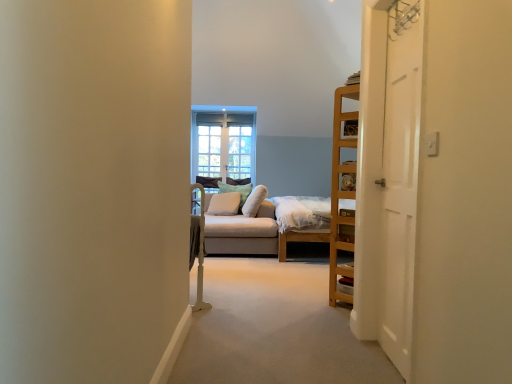
Question: Should I look upward or downward to see green fabric pillow at center, placed as the second pillow when sorted from right to left?

Choices:
 (A) down
 (B) up

Answer: (A)

Question: Is clear glass window at center further to camera compared to green fabric pillow at center, arranged as the 2th pillow when viewed from the left?

Choices:
 (A) no
 (B) yes

Answer: (B)

Question: Could you tell me if clear glass window at center is turned towards green fabric pillow at center, arranged as the 2th pillow when viewed from the left?

Choices:
 (A) no
 (B) yes

Answer: (B)

Question: Is clear glass window at center smaller than green fabric pillow at center, arranged as the 2th pillow when viewed from the left?

Choices:
 (A) yes
 (B) no

Answer: (A)

Question: From the image's perspective, is clear glass window at center above green fabric pillow at center, arranged as the 2th pillow when viewed from the left?

Choices:
 (A) yes
 (B) no

Answer: (A)

Question: Is clear glass window at center closer to the viewer compared to green fabric pillow at center, arranged as the 2th pillow when viewed from the left?

Choices:
 (A) no
 (B) yes

Answer: (A)

Question: Does clear glass window at center have a lesser height compared to green fabric pillow at center, arranged as the 2th pillow when viewed from the left?

Choices:
 (A) yes
 (B) no

Answer: (B)

Question: Does soft white cushion at center, which ranks as the 3th pillow in left-to-right order, have a smaller size compared to light gray fabric studio couch at center?

Choices:
 (A) yes
 (B) no

Answer: (A)

Question: Can you confirm if soft white cushion at center, the 1th pillow when ordered from right to left, is taller than light gray fabric studio couch at center?

Choices:
 (A) no
 (B) yes

Answer: (A)

Question: Is soft white cushion at center, which ranks as the 3th pillow in left-to-right order, facing towards light gray fabric studio couch at center?

Choices:
 (A) yes
 (B) no

Answer: (A)

Question: Does soft white cushion at center, which ranks as the 3th pillow in left-to-right order, have a lesser height compared to light gray fabric studio couch at center?

Choices:
 (A) no
 (B) yes

Answer: (B)

Question: Can you confirm if soft white cushion at center, the 1th pillow when ordered from right to left, is bigger than light gray fabric studio couch at center?

Choices:
 (A) yes
 (B) no

Answer: (B)

Question: Considering the relative positions of soft white cushion at center, the 1th pillow when ordered from right to left, and light gray fabric studio couch at center in the image provided, is soft white cushion at center, the 1th pillow when ordered from right to left, to the left of light gray fabric studio couch at center from the viewer's perspective?

Choices:
 (A) yes
 (B) no

Answer: (B)

Question: Is light green textured pillow at center, the third pillow positioned from the right, shorter than white wooden door at right?

Choices:
 (A) no
 (B) yes

Answer: (B)